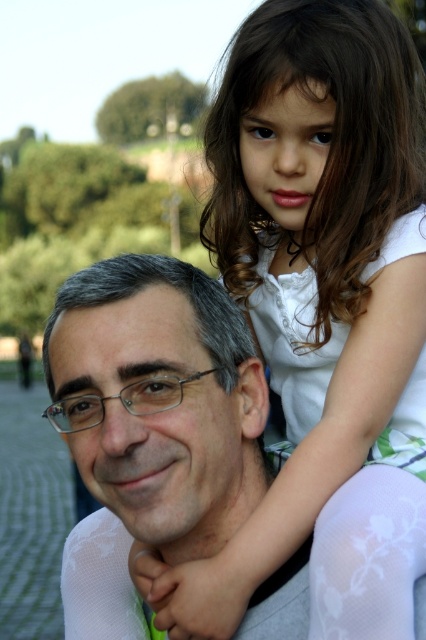
You are a photographer trying to capture a candid shot of the scene. You notice the white cotton shirt at upper right and the matte gray shirt at center. Which shirt should you focus on to ensure the subject in the foreground is properly framed?

The white cotton shirt at upper right is above the matte gray shirt at center, so focusing on the white cotton shirt at upper right will ensure the foreground subject is properly framed.

Consider the image. You are a photographer trying to capture a candid shot of the scene. You notice the white cotton shirt at upper right and the matte gray shirt at center. Which shirt should you adjust your camera angle to focus on if you want to capture the one closer to the right side of the image?

The white cotton shirt at upper right is positioned to the right of the matte gray shirt at center, so adjusting the camera angle to focus on the white cotton shirt at upper right will capture the shirt closer to the right side of the image.

You are an observer standing in the park scene. You notice two shirts in the image. Which shirt is wider, the white cotton shirt at upper right or the matte gray shirt at center?

The white cotton shirt at upper right is wider than the matte gray shirt at center according to the description.